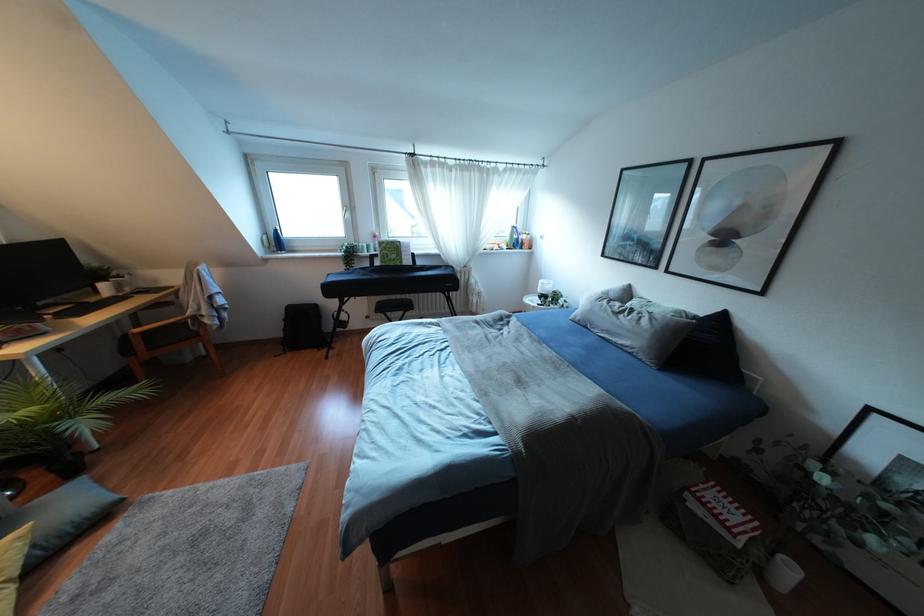
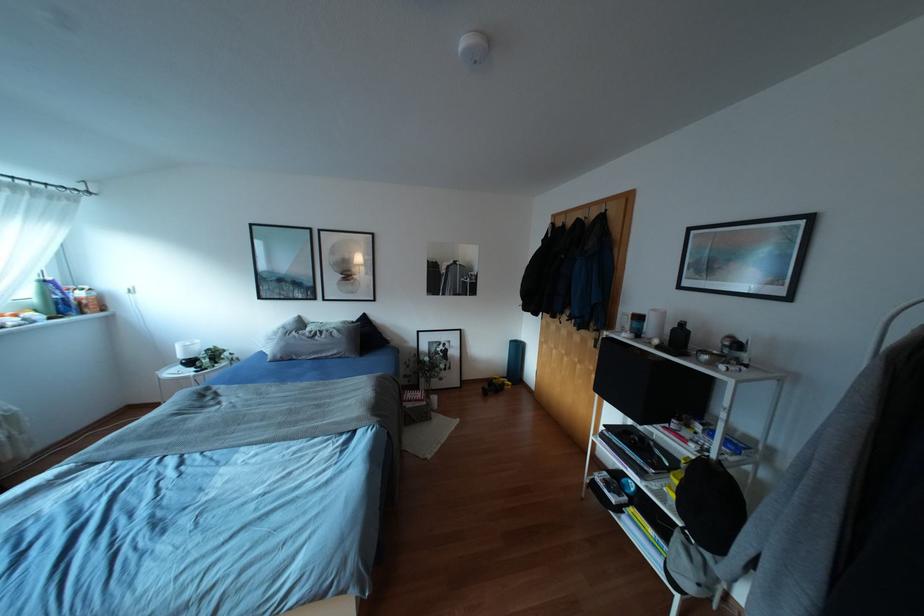
Where in the second image is the point corresponding to point 506,238 from the first image?

(35, 301)